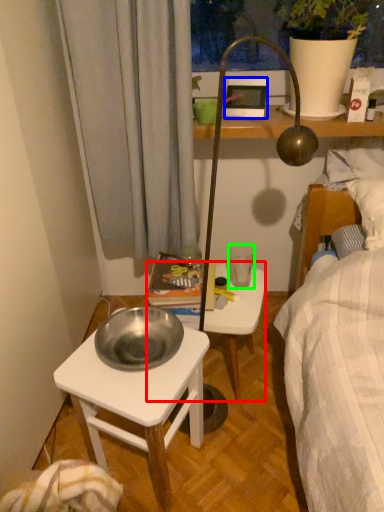
Question: Based on their relative distances, which object is farther from stool (highlighted by a red box)? Choose from picture frame (highlighted by a blue box) and coffee cup (highlighted by a green box).

Choices:
 (A) picture frame
 (B) coffee cup

Answer: (A)